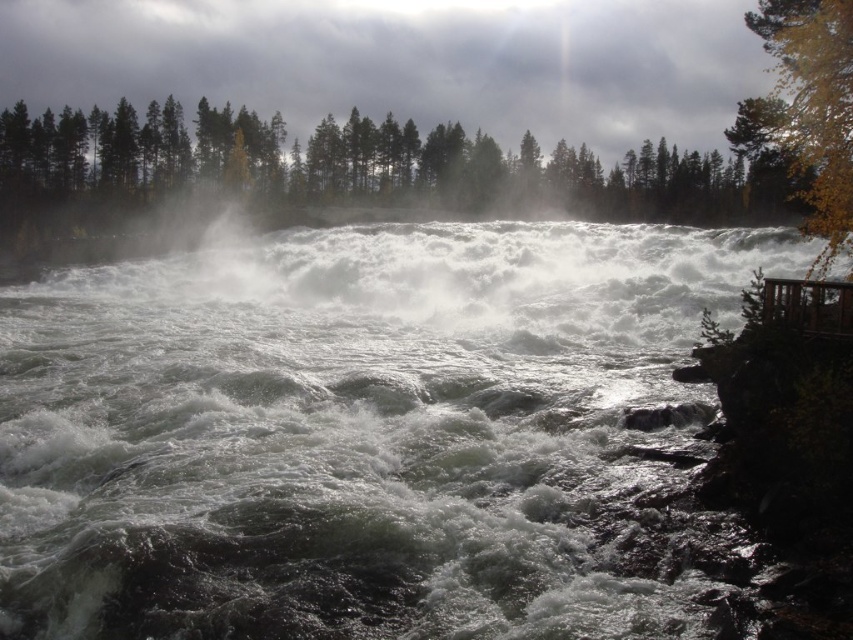
Question: Which point is farther to the camera?

Choices:
 (A) yellow leafy tree at right
 (B) white frothy water at center

Answer: (A)

Question: Does white frothy water at center lie behind yellow leafy tree at right?

Choices:
 (A) yes
 (B) no

Answer: (B)

Question: Which point appears closest to the camera in this image?

Choices:
 (A) (849, 129)
 (B) (325, 422)

Answer: (B)

Question: Is white frothy water at center to the right of yellow leafy tree at right from the viewer's perspective?

Choices:
 (A) yes
 (B) no

Answer: (B)

Question: Considering the relative positions of white frothy water at center and yellow leafy tree at right in the image provided, where is white frothy water at center located with respect to yellow leafy tree at right?

Choices:
 (A) below
 (B) above

Answer: (A)